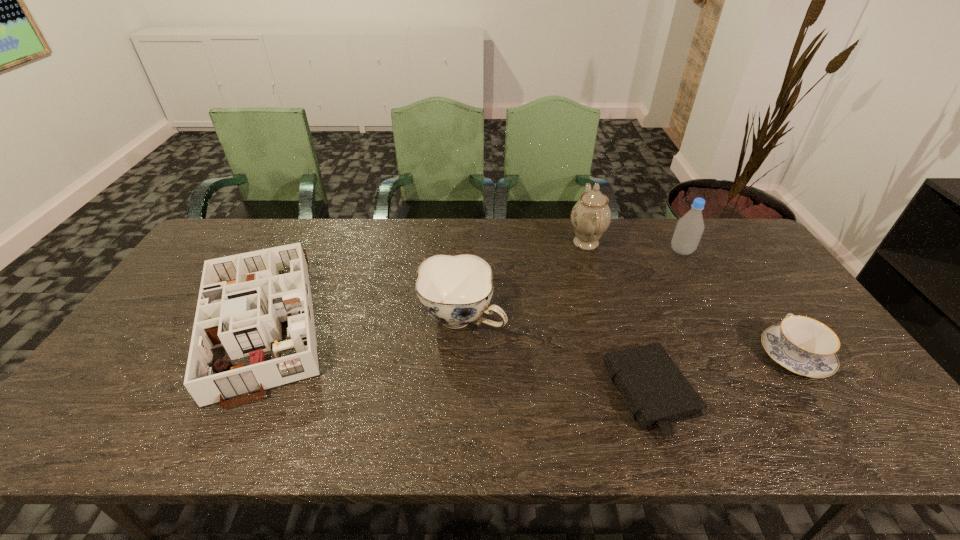
This screenshot has width=960, height=540. In order to click on blank space located on the spout of the farthest chinaware in this screenshot , I will do `click(461, 242)`.

Locate an element on the screen. This screenshot has width=960, height=540. free space located on the spout of the farthest chinaware is located at coordinates (505, 242).

Where is `free space located 0.090m on the right of the fifth object from left to right`? Image resolution: width=960 pixels, height=540 pixels. free space located 0.090m on the right of the fifth object from left to right is located at coordinates (721, 251).

You are a GUI agent. You are given a task and a screenshot of the screen. Output one action in this format:
    pyautogui.click(x=<x>, y=<y>)
    Task: Click on the vacant space situated on the left of the leftmost chinaware
    
    Given the screenshot: What is the action you would take?
    pyautogui.click(x=380, y=318)

This screenshot has width=960, height=540. In order to click on vacant space situated 0.160m on the right of the dollhouse in this screenshot , I will do `click(396, 321)`.

Locate an element on the screen. vacant space located with the handle on the side of the rightmost object is located at coordinates (739, 274).

Image resolution: width=960 pixels, height=540 pixels. What are the coordinates of `free space located 0.070m with the handle on the side of the rightmost object` in the screenshot? It's located at (764, 311).

What are the coordinates of `free space located with the handle on the side of the rightmost object` in the screenshot? It's located at pos(742,279).

I want to click on vacant space located on the back of the Bible, so click(x=621, y=309).

I want to click on chinaware at the far edge, so click(x=591, y=216).